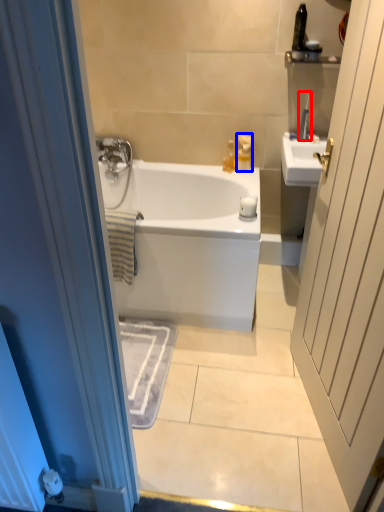
Question: Which of the following is the farthest to the observer, toiletry (highlighted by a red box) or toiletry (highlighted by a blue box)?

Choices:
 (A) toiletry
 (B) toiletry

Answer: (B)